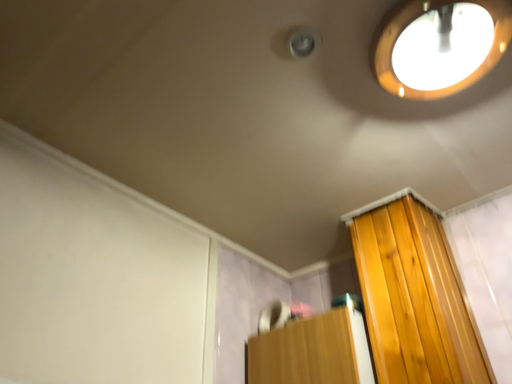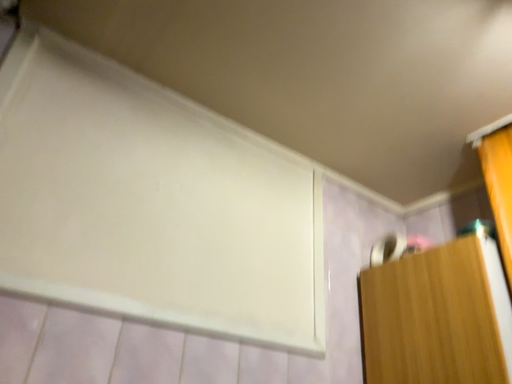
Question: Which way did the camera rotate in the video?

Choices:
 (A) rotated downward
 (B) rotated upward

Answer: (A)